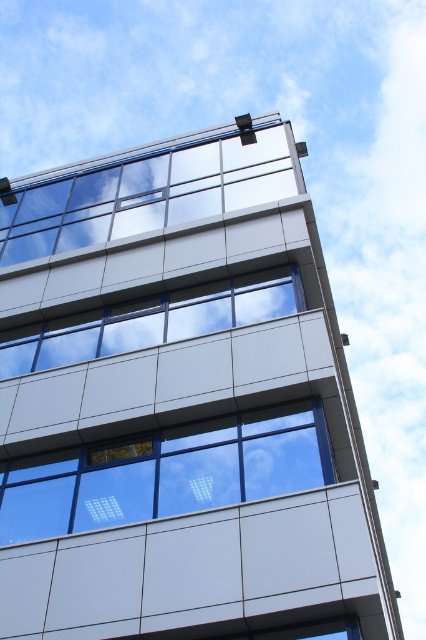
Which is above, transparent glass window at upper center or white glossy window at center?

transparent glass window at upper center

Locate an element on the screen. This screenshot has width=426, height=640. transparent glass window at upper center is located at coordinates (149, 193).

Is clear glass window at center bigger than transparent glass window at upper center?

No.

Is clear glass window at center taller than transparent glass window at upper center?

No, clear glass window at center is not taller than transparent glass window at upper center.

Who is more forward, (97, 513) or (204, 173)?

Point (97, 513) is in front.

This screenshot has width=426, height=640. Identify the location of clear glass window at center. (166, 472).

Can you confirm if clear glass window at center is positioned to the right of white glossy window at center?

No, clear glass window at center is not to the right of white glossy window at center.

Consider the image. Is clear glass window at center closer to the viewer compared to white glossy window at center?

Yes.

Is point (210, 442) positioned behind point (273, 285)?

No, (210, 442) is closer to viewer.

Where is `clear glass window at center`? The image size is (426, 640). clear glass window at center is located at coordinates (166, 472).